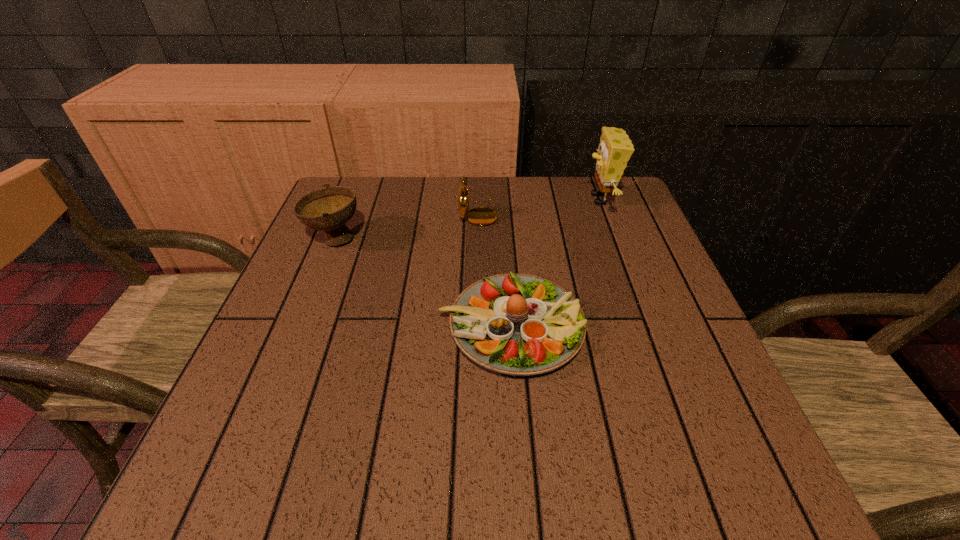
Find the location of `free spot located on the face of the pocket watch`. free spot located on the face of the pocket watch is located at coordinates (612, 212).

Locate an element on the screen. This screenshot has height=540, width=960. vacant space located on the back of the salad plate is located at coordinates (501, 184).

Identify the location of sponge that is at the far edge. (615, 149).

Find the location of a particular element. Image resolution: width=960 pixels, height=540 pixels. soup bowl situated at the far edge is located at coordinates (328, 209).

What are the coordinates of `pocket watch present at the far edge` in the screenshot? It's located at (481, 216).

You are a GUI agent. You are given a task and a screenshot of the screen. Output one action in this format:
    pyautogui.click(x=<x>, y=<y>)
    Task: Click on the object that is at the left edge
    Image resolution: width=960 pixels, height=540 pixels.
    Given the screenshot: What is the action you would take?
    pyautogui.click(x=328, y=209)

In order to click on object present at the right edge in this screenshot , I will do `click(615, 149)`.

This screenshot has height=540, width=960. In order to click on object present at the far left corner in this screenshot , I will do `click(328, 209)`.

Image resolution: width=960 pixels, height=540 pixels. What are the coordinates of `object at the far right corner` in the screenshot? It's located at (615, 149).

Where is `vacant space at the far edge of the desktop`? vacant space at the far edge of the desktop is located at coordinates (428, 217).